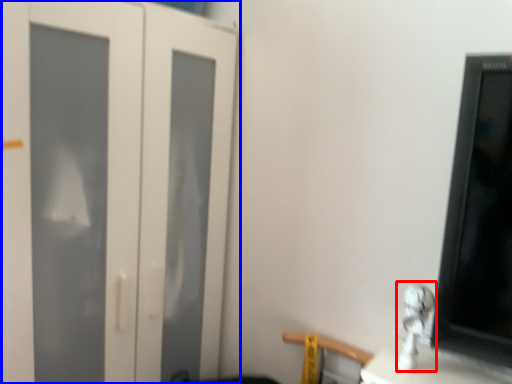
Question: Among these objects, which one is nearest to the camera, silver (highlighted by a red box) or door (highlighted by a blue box)?

Choices:
 (A) silver
 (B) door

Answer: (A)